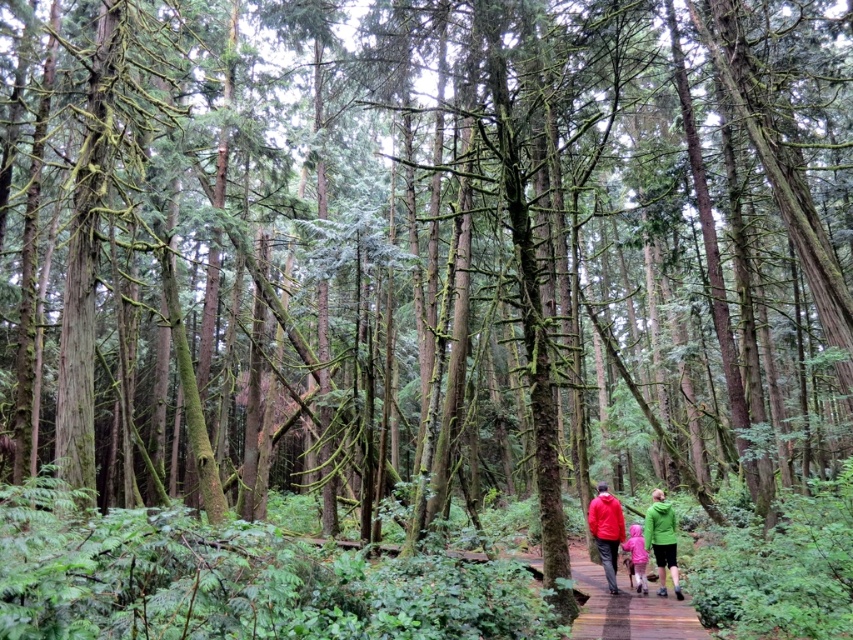
Question: Can you confirm if green matte jacket at center is thinner than pink fabric at center?

Choices:
 (A) no
 (B) yes

Answer: (B)

Question: Is green matte jacket at center further to camera compared to pink fabric at center?

Choices:
 (A) no
 (B) yes

Answer: (A)

Question: Is red matte jacket at center positioned at the back of green matte jacket at center?

Choices:
 (A) no
 (B) yes

Answer: (A)

Question: Which point is closer to the camera?

Choices:
 (A) (662, 500)
 (B) (640, 541)
 (C) (674, 586)
 (D) (614, 589)

Answer: (C)

Question: Which object is positioned farthest from the pink fabric at center?

Choices:
 (A) red matte jacket at center
 (B) matte red jacket at center

Answer: (B)

Question: Which point is farther to the camera?

Choices:
 (A) green matte jacket at center
 (B) pink fabric at center

Answer: (B)